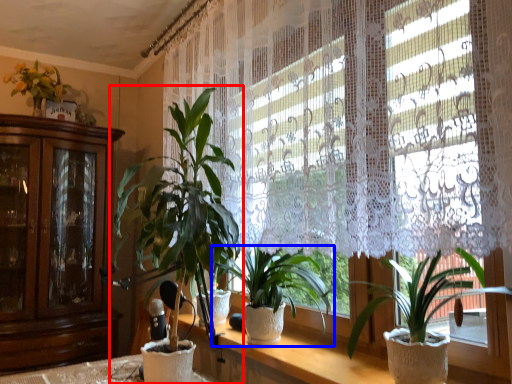
Question: Which object appears closest to the camera in this image, houseplant (highlighted by a red box) or houseplant (highlighted by a blue box)?

Choices:
 (A) houseplant
 (B) houseplant

Answer: (A)